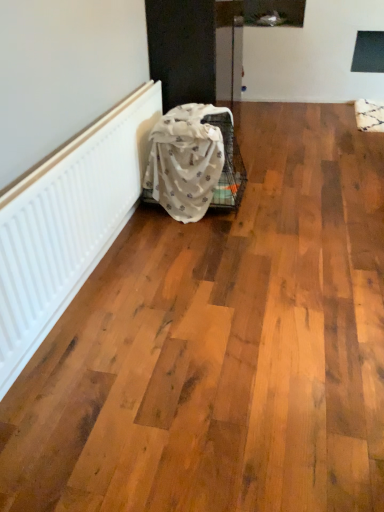
Question: Considering their positions, is white textured fabric at lower left located in front of or behind white textured radiator at left?

Choices:
 (A) front
 (B) behind

Answer: (B)

Question: From the image's perspective, is white textured fabric at lower left located above or below white textured radiator at left?

Choices:
 (A) below
 (B) above

Answer: (B)

Question: From a real-world perspective, is white textured fabric at lower left above or below white textured radiator at left?

Choices:
 (A) below
 (B) above

Answer: (A)

Question: From the image's perspective, is white textured radiator at left above or below white textured fabric at lower left?

Choices:
 (A) above
 (B) below

Answer: (B)

Question: Considering the positions of point (64, 207) and point (190, 172), is point (64, 207) closer or farther from the camera than point (190, 172)?

Choices:
 (A) farther
 (B) closer

Answer: (B)

Question: Is white textured radiator at left in front of or behind white textured fabric at lower left in the image?

Choices:
 (A) behind
 (B) front

Answer: (B)

Question: In the image, is white textured radiator at left on the left side or the right side of white textured fabric at lower left?

Choices:
 (A) right
 (B) left

Answer: (B)